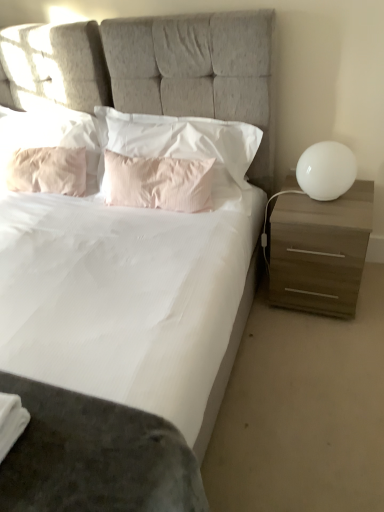
Image resolution: width=384 pixels, height=512 pixels. I want to click on free spot in front of light brown wood nightstand at right, so click(x=322, y=350).